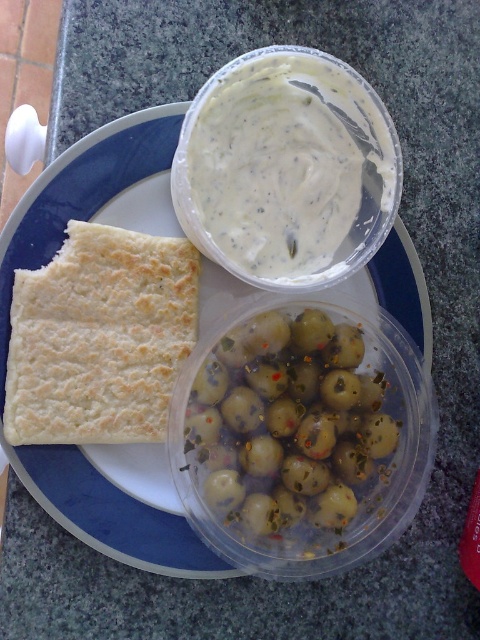
The image size is (480, 640). Describe the element at coordinates (288, 422) in the screenshot. I see `green glossy olives at center` at that location.

Identify the location of green glossy olives at center. (x=288, y=422).

Does white matte flatbread at left have a greater height compared to white crumbly flatbread at left?

Correct, white matte flatbread at left is much taller as white crumbly flatbread at left.

Does point (212, 577) come behind point (64, 292)?

That is True.

You are a GUI agent. You are given a task and a screenshot of the screen. Output one action in this format:
    pyautogui.click(x=<x>, y=<y>)
    Task: Click on the white matte flatbread at left
    The image size is (480, 640).
    Given the screenshot: What is the action you would take?
    pyautogui.click(x=105, y=445)

Describe the element at coordinates (105, 445) in the screenshot. I see `white matte flatbread at left` at that location.

Measure the distance between white matte flatbread at left and camera.

white matte flatbread at left is 70.76 centimeters away from camera.

The height and width of the screenshot is (640, 480). Describe the element at coordinates (105, 445) in the screenshot. I see `white matte flatbread at left` at that location.

This screenshot has width=480, height=640. I want to click on white matte flatbread at left, so click(105, 445).